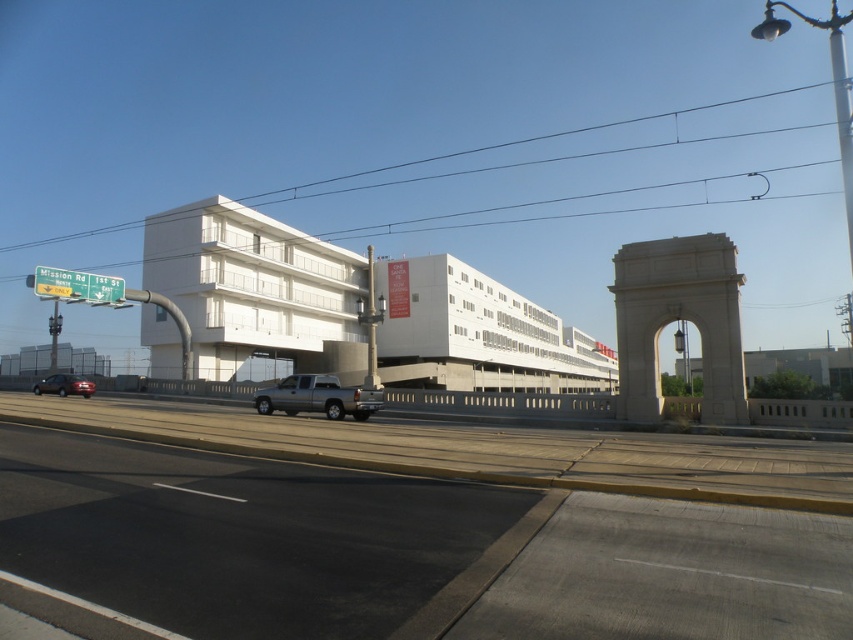
You are standing at the point labeled point (x=657, y=500) and want to walk to the point labeled point (x=86, y=380). Which direction should you face to walk directly towards your destination?

You should face west because point (x=86, y=380) is to the west of point (x=657, y=500).

In the scene shown: You are standing at the point marked by the coordinates point (x=317, y=397). What object is located exactly at that point?

The point (x=317, y=397) marks the gray metallic truck at center.